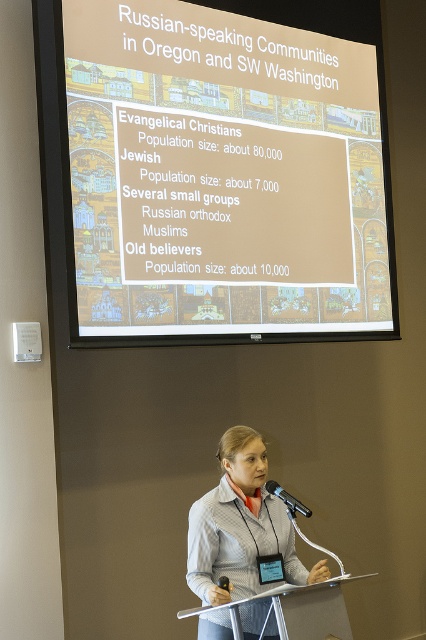
Question: From the image, what is the correct spatial relationship of gray fabric jacket at center in relation to black metallic microphone at center?

Choices:
 (A) above
 (B) below

Answer: (B)

Question: Observing the image, what is the correct spatial positioning of white matte projection screen at upper center in reference to silver metallic podium at center?

Choices:
 (A) right
 (B) left

Answer: (A)

Question: Estimate the real-world distances between objects in this image. Which object is farther from the gray fabric jacket at center?

Choices:
 (A) white matte projection screen at upper center
 (B) black metallic microphone at center
 (C) silver metallic podium at center

Answer: (A)

Question: Can you confirm if gray fabric jacket at center is positioned to the right of silver metallic podium at center?

Choices:
 (A) yes
 (B) no

Answer: (B)

Question: Which point is farther to the camera?

Choices:
 (A) (209, 592)
 (B) (276, 621)
 (C) (276, 493)

Answer: (C)

Question: Which point is farther to the camera?

Choices:
 (A) white matte projection screen at upper center
 (B) black metallic microphone at center

Answer: (A)